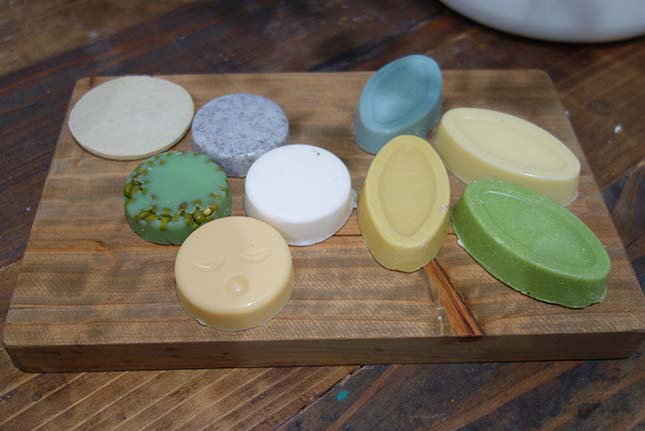
The height and width of the screenshot is (431, 645). I want to click on green soap, so click(560, 254), click(184, 191).